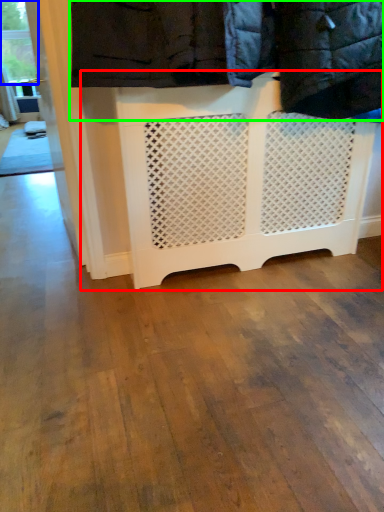
Question: Which object is positioned closest to furniture (highlighted by a red box)? Select from window frame (highlighted by a blue box) and laundry (highlighted by a green box).

Choices:
 (A) window frame
 (B) laundry

Answer: (B)